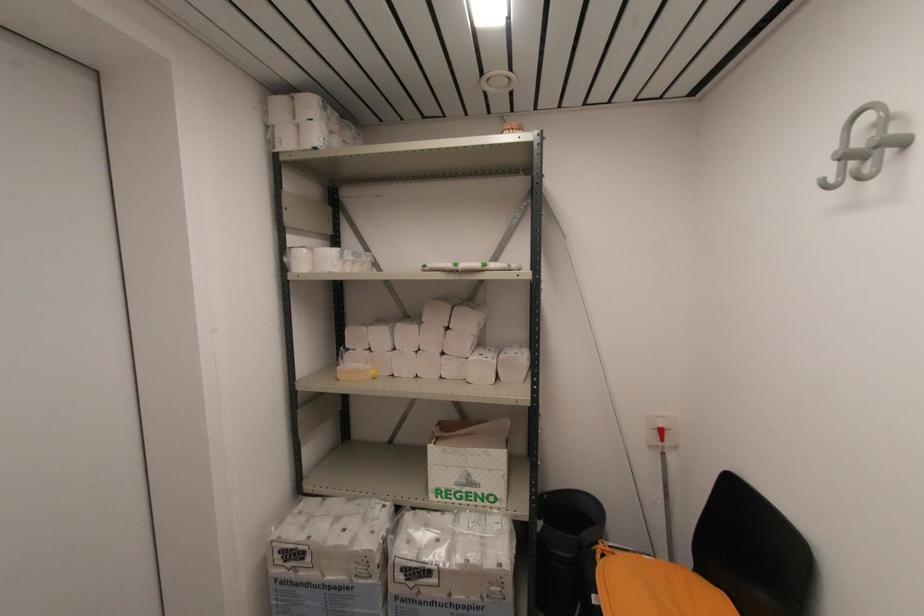
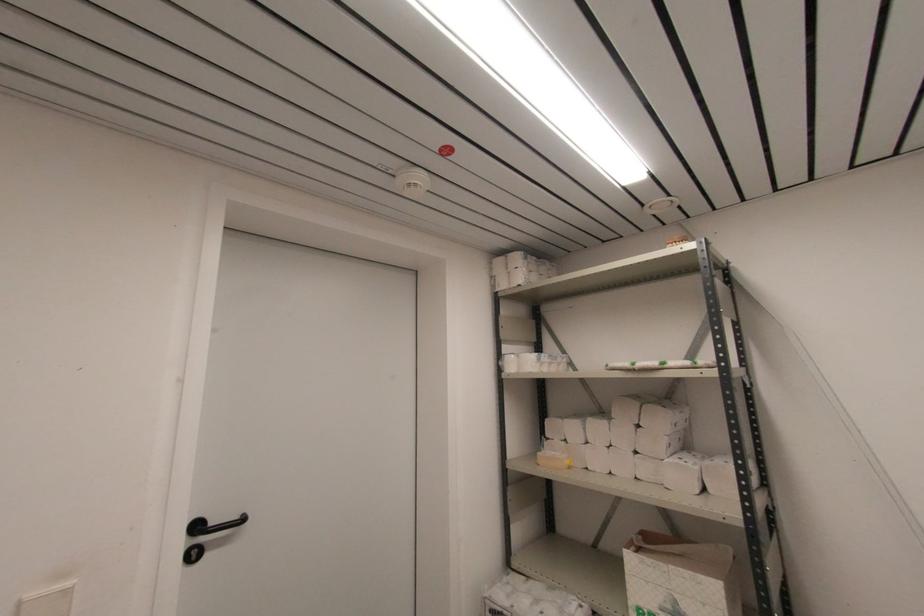
In the second image, find the point that corresponds to (444,354) in the first image.

(637, 453)